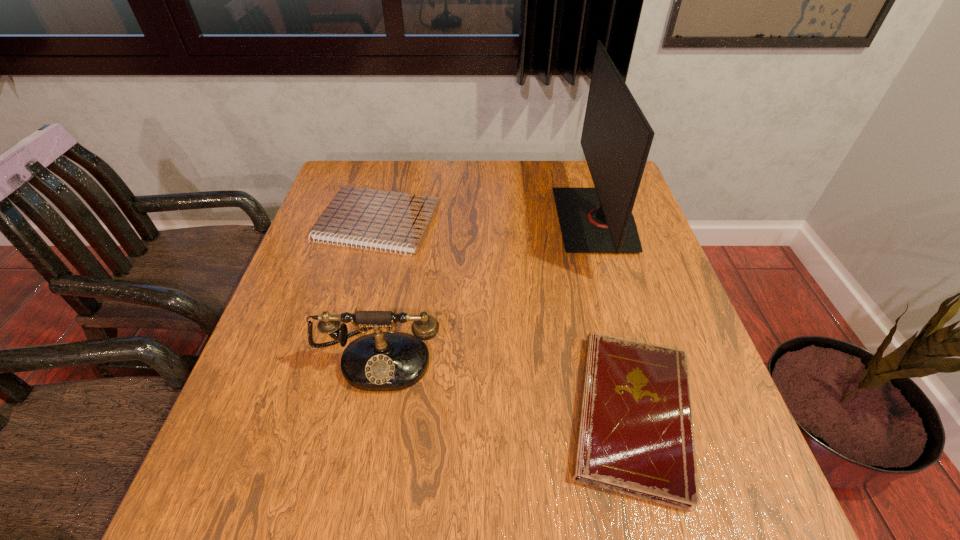
Locate an element on the screen. blank space at the far edge of the desktop is located at coordinates (399, 192).

This screenshot has width=960, height=540. Find the location of `free space at the left edge of the desktop`. free space at the left edge of the desktop is located at coordinates (301, 341).

Where is `free space at the right edge`? The height and width of the screenshot is (540, 960). free space at the right edge is located at coordinates (722, 396).

Locate an element on the screen. free spot between the telephone and the monitor is located at coordinates (488, 288).

I want to click on vacant area between the third shortest object and the right notebook, so (x=506, y=384).

This screenshot has height=540, width=960. What are the coordinates of `vacant space that's between the monitor and the telephone` in the screenshot? It's located at (488, 288).

Where is `free spot between the monitor and the right notebook`? free spot between the monitor and the right notebook is located at coordinates (613, 317).

Locate an element on the screen. Image resolution: width=960 pixels, height=540 pixels. vacant space that is in between the tallest object and the second tallest object is located at coordinates (488, 288).

This screenshot has height=540, width=960. I want to click on free spot between the telephone and the farther notebook, so click(378, 289).

Where is `vacant space in between the nearer notebook and the farther notebook`? The image size is (960, 540). vacant space in between the nearer notebook and the farther notebook is located at coordinates (505, 319).